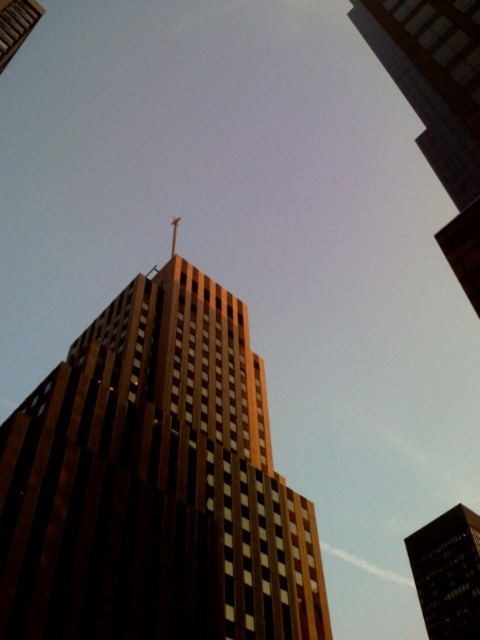
Does point (216, 620) come in front of point (175, 220)?

Yes, point (216, 620) is in front of point (175, 220).

Can you confirm if brown textured building at center is positioned to the right of shiny gold spire at top?

Correct, you'll find brown textured building at center to the right of shiny gold spire at top.

Measure the distance between brown textured building at center and camera.

The distance of brown textured building at center from camera is 30.08 meters.

You are a GUI agent. You are given a task and a screenshot of the screen. Output one action in this format:
    pyautogui.click(x=<x>, y=<y>)
    Task: Click on the brown textured building at center
    This screenshot has height=640, width=480.
    Given the screenshot: What is the action you would take?
    pyautogui.click(x=155, y=483)

Which is more to the right, brown textured building at center or brown glass building at upper center?

From the viewer's perspective, brown glass building at upper center appears more on the right side.

Does point (116, 403) come behind point (456, 598)?

No, (116, 403) is closer to viewer.

Identify the location of brown textured building at center. click(155, 483).

Is brown glass building at upper center thinner than shiny gold spire at top?

Indeed, brown glass building at upper center has a lesser width compared to shiny gold spire at top.

Between point (468, 572) and point (177, 227), which one is positioned in front?

Point (468, 572) is in front.

Find the location of a particular element. The height and width of the screenshot is (640, 480). brown glass building at upper center is located at coordinates (447, 573).